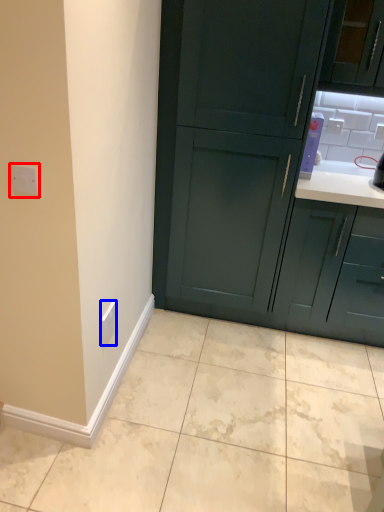
Question: Which object is further to the camera taking this photo, electric outlet (highlighted by a red box) or electric outlet (highlighted by a blue box)?

Choices:
 (A) electric outlet
 (B) electric outlet

Answer: (B)